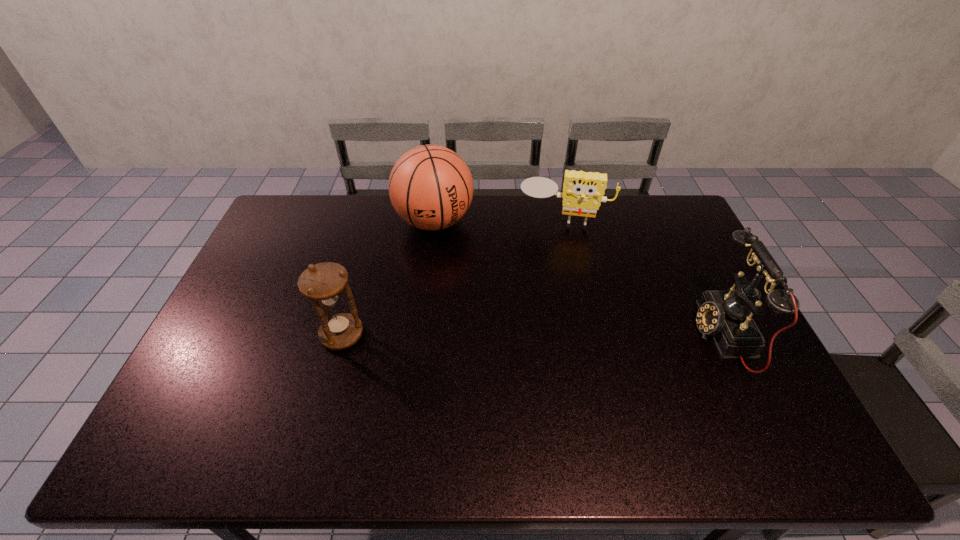
The width and height of the screenshot is (960, 540). In order to click on vacant region at the near edge of the desktop in this screenshot , I will do `click(543, 406)`.

You are a GUI agent. You are given a task and a screenshot of the screen. Output one action in this format:
    pyautogui.click(x=<x>, y=<y>)
    Task: Click on the vacant space at the left edge of the desktop
    
    Given the screenshot: What is the action you would take?
    pyautogui.click(x=233, y=336)

What are the coordinates of `free region at the right edge of the desktop` in the screenshot? It's located at (749, 366).

This screenshot has width=960, height=540. Identify the location of free region at the far left corner of the desktop. coord(305,232).

The width and height of the screenshot is (960, 540). What are the coordinates of `free space at the near left corner of the desktop` in the screenshot? It's located at (182, 415).

In the image, there is a desktop. What are the coordinates of `vacant space at the far right corner` in the screenshot? It's located at (671, 234).

Image resolution: width=960 pixels, height=540 pixels. Identify the location of vacant space that's between the second object from right to left and the basketball. pos(498,221).

Where is `free point between the third object from left to right and the leftmost object`? The image size is (960, 540). free point between the third object from left to right and the leftmost object is located at coordinates (x=452, y=278).

Locate an element on the screen. The height and width of the screenshot is (540, 960). free space between the third object from right to left and the second object from right to left is located at coordinates coord(498,221).

The image size is (960, 540). In order to click on free space that is in between the hourglass and the third object from right to left in this screenshot , I will do `click(388, 278)`.